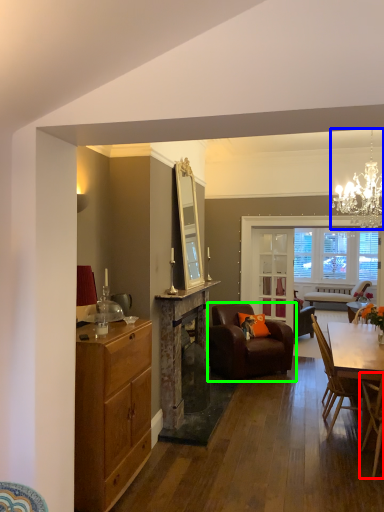
Question: Which object is positioned farthest from chair (highlighted by a red box)? Select from light fixture (highlighted by a blue box) and chair (highlighted by a green box).

Choices:
 (A) light fixture
 (B) chair

Answer: (A)